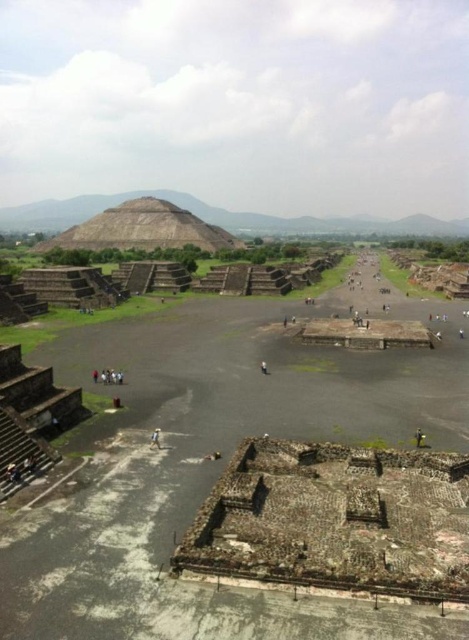
Can you confirm if yellow fabric person at center is positioned to the right of white fabric person at center?

Correct, you'll find yellow fabric person at center to the right of white fabric person at center.

Who is higher up, yellow fabric person at center or white fabric person at center?

white fabric person at center is above.

Which is in front, point (423, 440) or point (261, 369)?

Point (423, 440) is more forward.

This screenshot has height=640, width=469. Find the location of `yellow fabric person at center`. yellow fabric person at center is located at coordinates (418, 436).

Who is more distant from viewer, [242,244] or [158,433]?

The point [242,244] is more distant.

Describe the element at coordinates (143, 228) in the screenshot. I see `smooth stone pyramid at center` at that location.

Identify the location of smooth stone pyramid at center. Image resolution: width=469 pixels, height=640 pixels. (143, 228).

Who is shorter, blurred human figure at center or white fabric person at center?

blurred human figure at center

Who is lower down, blurred human figure at center or white fabric person at center?

blurred human figure at center

Describe the element at coordinates (154, 438) in the screenshot. I see `blurred human figure at center` at that location.

The height and width of the screenshot is (640, 469). Find the location of `blurred human figure at center`. blurred human figure at center is located at coordinates (154, 438).